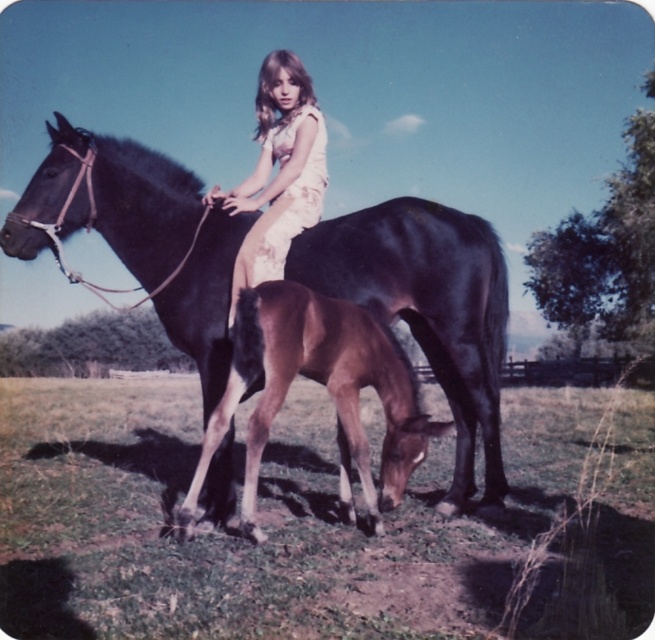
You are a photographer trying to capture a portrait of the shiny dark brown horse at center and the matte floral dress at center. Which object should you focus on first if you want to ensure both are in sharp focus?

The shiny dark brown horse at center is located below the matte floral dress at center. Since the horse is lower in the frame, you should focus on the horse first to ensure both are in sharp focus as you adjust the camera settings.

You are a photographer trying to capture a photo of the shiny dark brown horse at center and the matte floral dress at center. From the perspective of the photographer standing in front of the scene, which object is positioned to the right?

The shiny dark brown horse at center is to the right of the matte floral dress at center, so the shiny dark brown horse at center is positioned to the right.